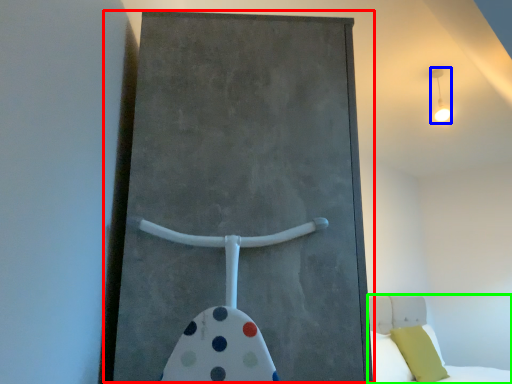
Question: Considering the real-world distances, which object is closest to barn door (highlighted by a red box)? light fixture (highlighted by a blue box) or bed (highlighted by a green box).

Choices:
 (A) light fixture
 (B) bed

Answer: (A)